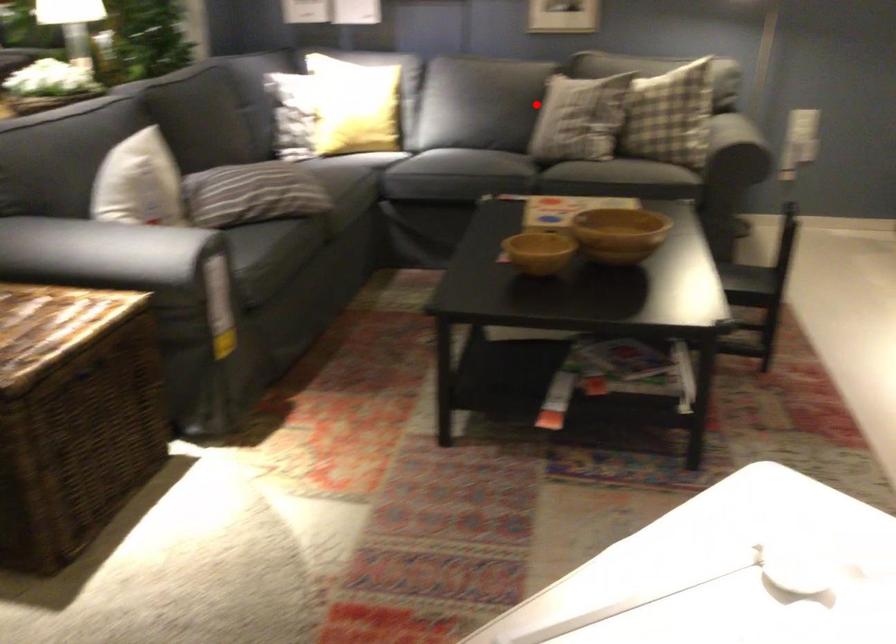
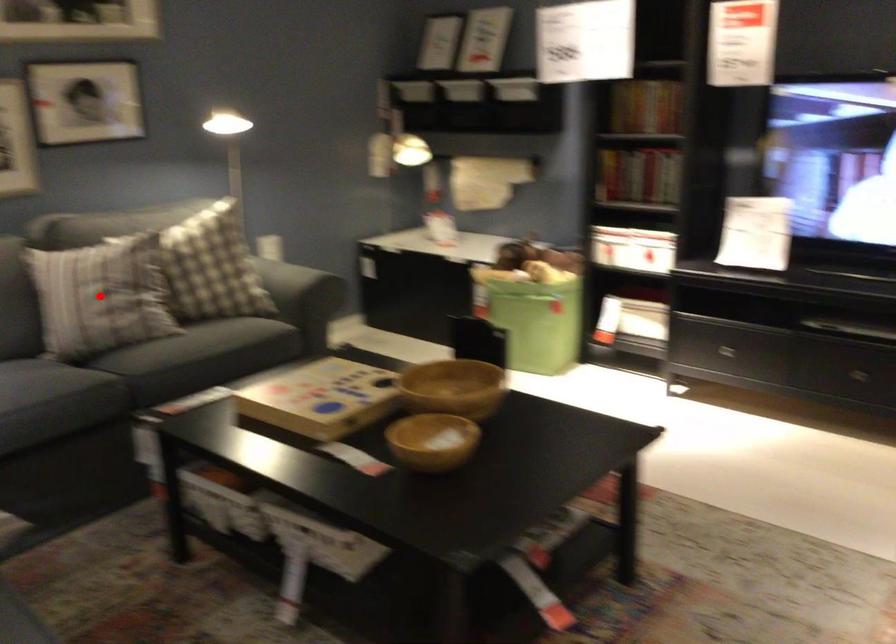
I am providing you with two images of the same scene from different viewpoints. A red point is marked on the first image and another point is marked on the second image. Does the point marked in image1 correspond to the same location as the one in image2?

Yes